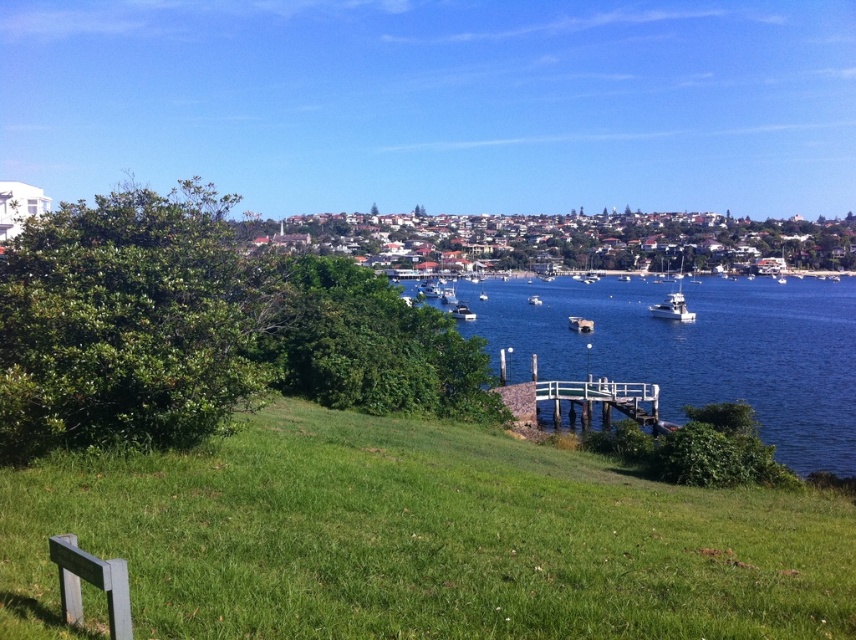
You are standing at the viewpoint behind the wooden railing in the bottom left corner. You want to walk to the white glossy boat at center. Is the white wooden dock at lower center in your way?

The white wooden dock at lower center has a smaller size compared to the white glossy boat at center, so it is likely positioned closer to you. Since the dock is between you and the boat, it would be in your way as you walk toward the boat.

You are standing at the viewpoint overlooking the coast and notice the green grassy at lower center and the white wooden dock at lower center. Which object is closer to you from your current position?

The green grassy at lower center is closer to you because it is positioned over the white wooden dock at lower center, indicating it is in a higher elevation or in front of it.

You are standing at the viewpoint overlooking the coast and see the green grassy at lower center and the white wooden dock at lower center. Which one covers a wider area in the scene?

The green grassy at lower center covers a wider area than the white wooden dock at lower center because its width is larger according to the description.